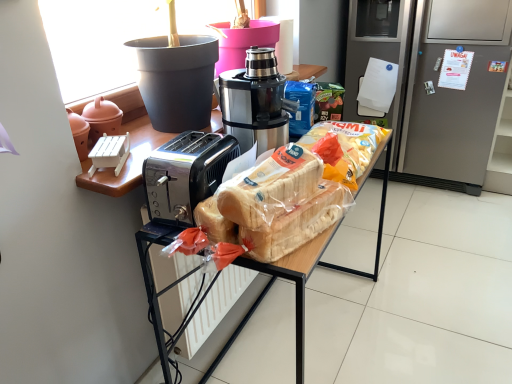
Question: Is matte black toaster at center spatially inside matte pink pot at left, or outside of it?

Choices:
 (A) inside
 (B) outside

Answer: (B)

Question: Would you say matte black toaster at center is to the left or to the right of matte pink pot at left in the picture?

Choices:
 (A) left
 (B) right

Answer: (B)

Question: Based on their relative distances, which object is nearer to the matte pink pot at left?

Choices:
 (A) satin black coffee maker at center
 (B) translucent plastic bread at center
 (C) silver metallic refrigerator at right
 (D) matte black toaster at center

Answer: (A)

Question: Which object is the farthest from the matte black toaster at center?

Choices:
 (A) translucent plastic bread at center
 (B) matte pink pot at left
 (C) satin black coffee maker at center
 (D) silver metallic refrigerator at right

Answer: (D)